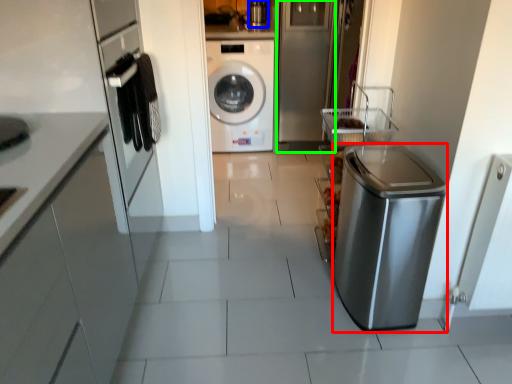
Question: Which object is the closest to the dish washer (highlighted by a red box)? Choose among these: appliance (highlighted by a blue box) or glass door (highlighted by a green box).

Choices:
 (A) appliance
 (B) glass door

Answer: (B)